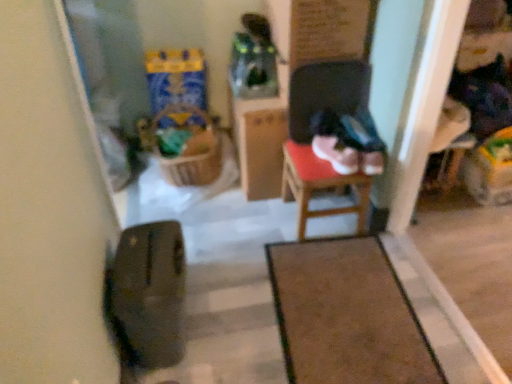
The image size is (512, 384). What are the coordinates of `free space to the left of brown carpet at center` in the screenshot? It's located at (234, 294).